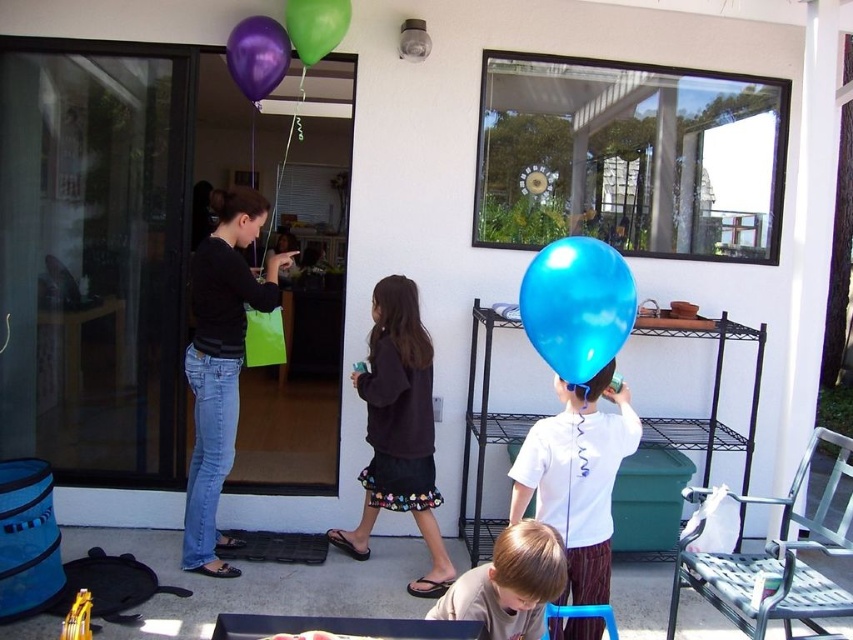
You are planning to hang a decoration from the ceiling in the center of the patio. There is already a metallic purple balloon at upper center. Where should you place the new decoration to avoid overlapping with the existing balloon?

The metallic purple balloon at upper center is located at point (257, 54), so you should place the new decoration away from that coordinate to avoid overlapping.